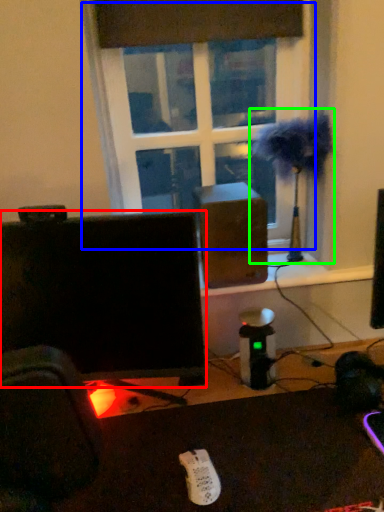
Question: Considering the real-world distances, which object is farthest from computer monitor (highlighted by a red box)? window (highlighted by a blue box) or table lamp (highlighted by a green box)?

Choices:
 (A) window
 (B) table lamp

Answer: (B)